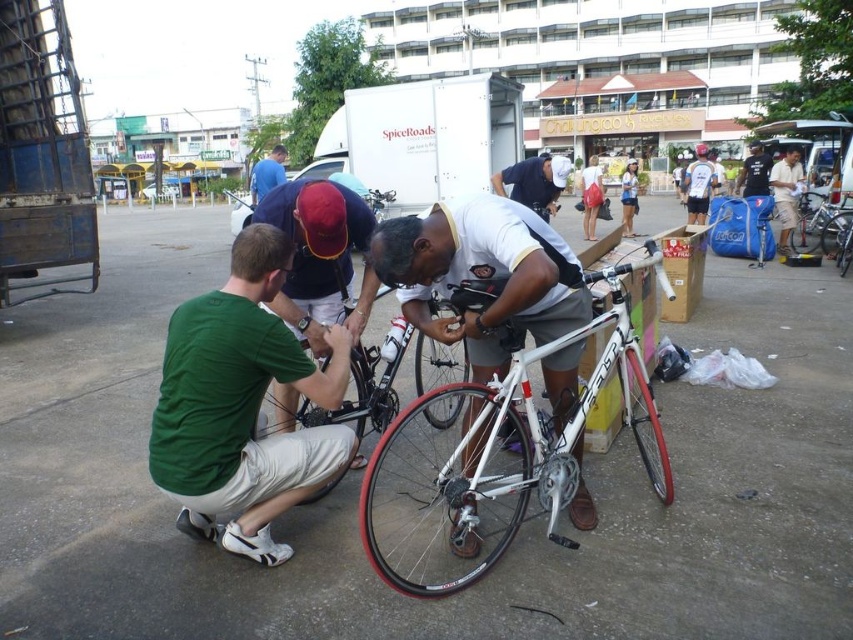
You are a delivery person who needs to quickly access the white matte bicycle at center. Considering the denim shorts at center is blocking the path, can you easily reach the bicycle?

The white matte bicycle at center is behind denim shorts at center, so you cannot easily reach the bicycle until the denim shorts at center moves out of the way.